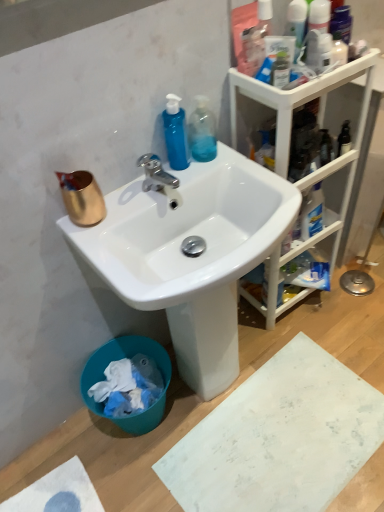
Question: From a real-world perspective, is copper metallic cup at upper left below chrome metallic faucet at upper center?

Choices:
 (A) yes
 (B) no

Answer: (B)

Question: Considering the relative sizes of copper metallic cup at upper left and chrome metallic faucet at upper center in the image provided, is copper metallic cup at upper left shorter than chrome metallic faucet at upper center?

Choices:
 (A) no
 (B) yes

Answer: (A)

Question: Is copper metallic cup at upper left facing towards chrome metallic faucet at upper center?

Choices:
 (A) no
 (B) yes

Answer: (A)

Question: Considering the relative sizes of copper metallic cup at upper left and chrome metallic faucet at upper center in the image provided, is copper metallic cup at upper left taller than chrome metallic faucet at upper center?

Choices:
 (A) yes
 (B) no

Answer: (A)

Question: Does copper metallic cup at upper left have a larger size compared to chrome metallic faucet at upper center?

Choices:
 (A) no
 (B) yes

Answer: (B)

Question: Can you see copper metallic cup at upper left touching chrome metallic faucet at upper center?

Choices:
 (A) no
 (B) yes

Answer: (A)

Question: Does teal plastic trash bin at lower left appear on the right side of transparent plastic bottle at upper center, placed as the 1th cleaning product when sorted from right to left?

Choices:
 (A) yes
 (B) no

Answer: (B)

Question: Would you say transparent plastic bottle at upper center, placed as the 1th cleaning product when sorted from right to left, is part of teal plastic trash bin at lower left's contents?

Choices:
 (A) no
 (B) yes

Answer: (A)

Question: Considering the relative sizes of teal plastic trash bin at lower left and transparent plastic bottle at upper center, the second cleaning product from the left, in the image provided, is teal plastic trash bin at lower left wider than transparent plastic bottle at upper center, the second cleaning product from the left,?

Choices:
 (A) no
 (B) yes

Answer: (B)

Question: Does teal plastic trash bin at lower left come behind transparent plastic bottle at upper center, the second cleaning product from the left?

Choices:
 (A) no
 (B) yes

Answer: (B)

Question: Considering the relative sizes of teal plastic trash bin at lower left and transparent plastic bottle at upper center, placed as the 1th cleaning product when sorted from right to left, in the image provided, is teal plastic trash bin at lower left taller than transparent plastic bottle at upper center, placed as the 1th cleaning product when sorted from right to left,?

Choices:
 (A) yes
 (B) no

Answer: (A)

Question: Can we say teal plastic trash bin at lower left lies outside transparent plastic bottle at upper center, the second cleaning product from the left?

Choices:
 (A) no
 (B) yes

Answer: (B)

Question: Is transparent plastic bottle at upper center, placed as the 1th cleaning product when sorted from right to left, to the left of translucent plastic bottle at upper right from the viewer's perspective?

Choices:
 (A) no
 (B) yes

Answer: (B)